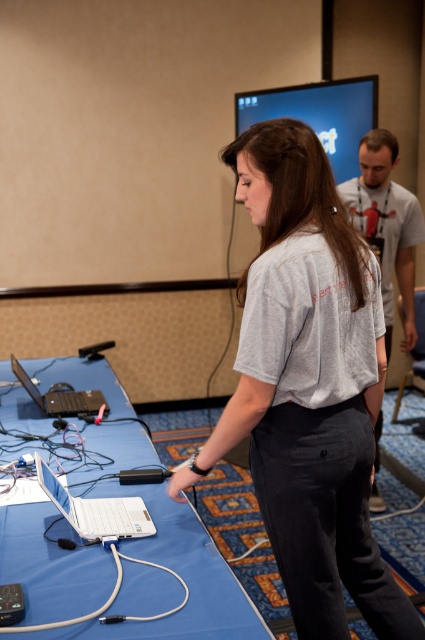
Measure the distance between point (x=96, y=509) and camera.

Point (x=96, y=509) and camera are 1.57 meters apart.

Measure the distance from white plastic laptop at lower left to silver metallic laptop at lower left.

white plastic laptop at lower left is 81.39 centimeters away from silver metallic laptop at lower left.

The width and height of the screenshot is (425, 640). Find the location of `white plastic laptop at lower left`. white plastic laptop at lower left is located at coordinates (96, 509).

How distant is gray cotton shirt at center from white plastic table at lower left?

gray cotton shirt at center and white plastic table at lower left are 25.08 inches apart from each other.

From the picture: Who is more forward, (354, 269) or (87, 604)?

Positioned in front is point (87, 604).

Locate an element on the screen. This screenshot has height=640, width=425. gray cotton shirt at center is located at coordinates (308, 387).

Who is more distant from viewer, (323,442) or (115,516)?

The point (115,516) is more distant.

Consider the image. Between gray cotton shirt at center and white plastic laptop at lower left, which one is positioned higher?

Positioned higher is gray cotton shirt at center.

What do you see at coordinates (308, 387) in the screenshot?
I see `gray cotton shirt at center` at bounding box center [308, 387].

Where is `gray cotton shirt at center`? The width and height of the screenshot is (425, 640). gray cotton shirt at center is located at coordinates (308, 387).